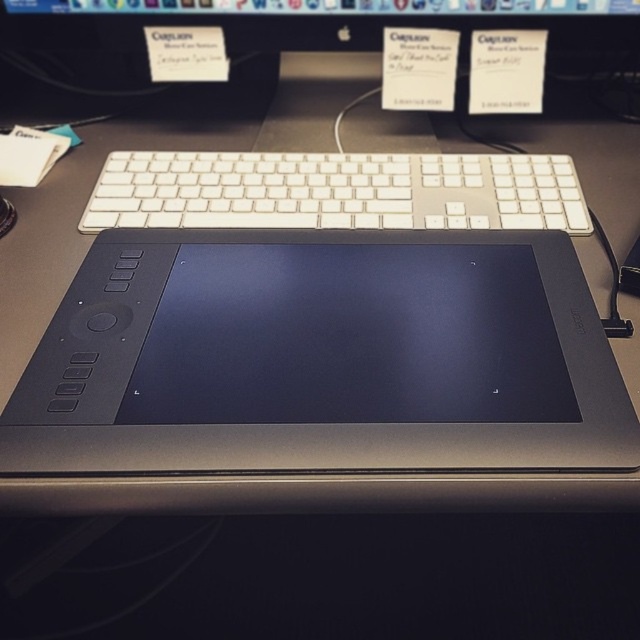
From the picture: Who is shorter, black matte tablet at center or black plastic computer monitor at upper center?

Standing shorter between the two is black plastic computer monitor at upper center.

Is point (257, 436) positioned after point (96, 20)?

No, (257, 436) is closer to viewer.

Describe the element at coordinates (321, 358) in the screenshot. The height and width of the screenshot is (640, 640). I see `black matte tablet at center` at that location.

At what (x,y) coordinates should I click in order to perform the action: click on black matte tablet at center. Please return your answer as a coordinate pair (x, y). The image size is (640, 640). Looking at the image, I should click on (321, 358).

How distant is black matte tablet at center from white plastic keyboard at upper center?

black matte tablet at center and white plastic keyboard at upper center are 5.09 inches apart.

Is black matte tablet at center positioned before white plastic keyboard at upper center?

Yes, it is.

Between point (56, 353) and point (416, 198), which one is positioned in front?

Point (56, 353)

The height and width of the screenshot is (640, 640). I want to click on black matte tablet at center, so click(321, 358).

Who is taller, white plastic keyboard at upper center or black plastic computer monitor at upper center?

With more height is white plastic keyboard at upper center.

Does point (356, 193) lie behind point (257, 10)?

No.

This screenshot has height=640, width=640. Identify the location of white plastic keyboard at upper center. (336, 192).